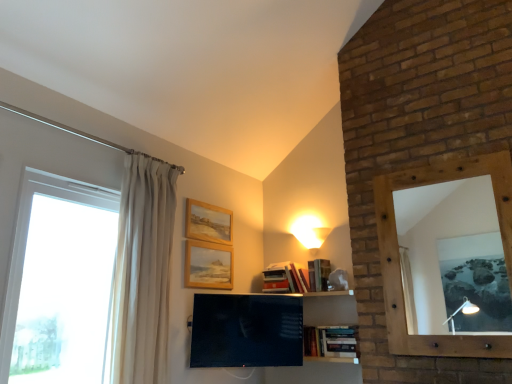
Question: Is white glass window at left bigger or smaller than matte black tv at center?

Choices:
 (A) small
 (B) big

Answer: (B)

Question: Considering the positions of white glass window at left and matte black tv at center in the image, is white glass window at left taller or shorter than matte black tv at center?

Choices:
 (A) tall
 (B) short

Answer: (A)

Question: Which is nearer to the hardcover books at center?

Choices:
 (A) wooden picture frame at upper center, the 1th picture frame positioned from the bottom
 (B) wooden picture frame at upper center, which appears as the first picture frame when viewed from the top
 (C) matte white lampshade at upper center
 (D) matte black tv at center
 (E) wooden-framed mirror at right

Answer: (D)

Question: Which object is positioned farthest from the matte white lampshade at upper center?

Choices:
 (A) white sheer curtain at left
 (B) matte black tv at center
 (C) hardcover books at center
 (D) wooden picture frame at upper center, which appears as the second picture frame when viewed from the top
 (E) wooden picture frame at upper center, which appears as the first picture frame when viewed from the top

Answer: (A)